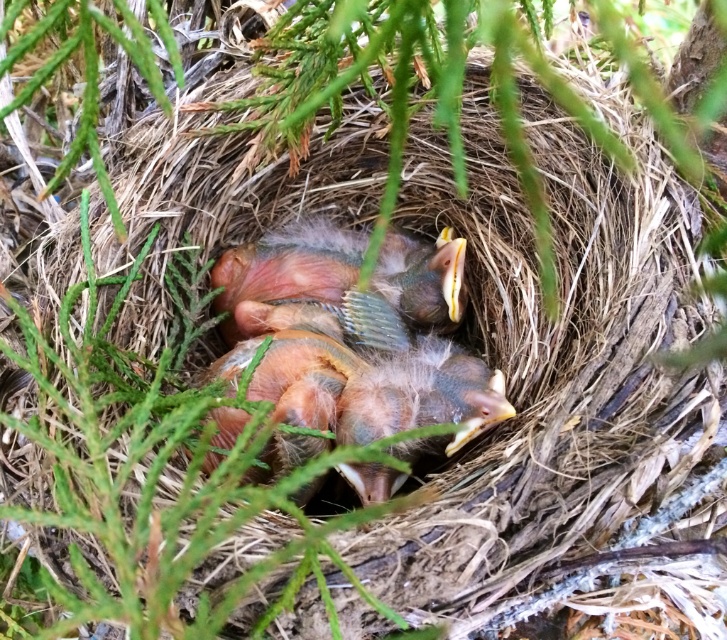
Question: Which of these objects is positioned farthest from the fluffy brown bird at center?

Choices:
 (A) soft brown feathers at center
 (B) fluffy pinkish-brown baby bird at center

Answer: (B)

Question: Which of the following is the closest to the observer?

Choices:
 (A) (449, 236)
 (B) (382, 378)

Answer: (B)

Question: In this image, where is soft brown feathers at center located relative to fluffy brown bird at center?

Choices:
 (A) below
 (B) above

Answer: (B)

Question: Is soft brown feathers at center behind fluffy pinkish-brown baby bird at center?

Choices:
 (A) yes
 (B) no

Answer: (B)

Question: Which of these objects is positioned closest to the soft brown feathers at center?

Choices:
 (A) fluffy pinkish-brown baby bird at center
 (B) fluffy brown bird at center

Answer: (B)

Question: Is soft brown feathers at center further to the viewer compared to fluffy pinkish-brown baby bird at center?

Choices:
 (A) yes
 (B) no

Answer: (B)